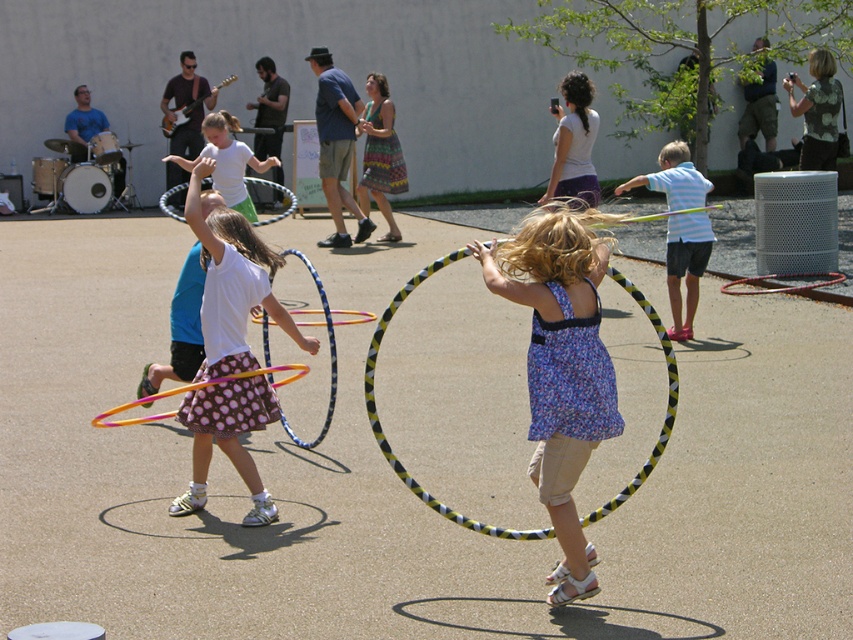
Question: From the image, what is the correct spatial relationship of floral fabric dress at center in relation to yellow and black striped hula hoop at center?

Choices:
 (A) above
 (B) below

Answer: (A)

Question: Which object is positioned closest to the white plastic hula hoop at center?

Choices:
 (A) white matte hula hoop at center
 (B) yellow and black striped hula hoop at center
 (C) white cotton shirt at center
 (D) floral fabric dress at center

Answer: (A)

Question: Is yellow and black striped hula hoop at center to the left of white matte hula hoop at center from the viewer's perspective?

Choices:
 (A) yes
 (B) no

Answer: (B)

Question: Which of these objects is positioned closest to the white matte hula hoop at center?

Choices:
 (A) white plastic hula hoop at center
 (B) floral fabric dress at center
 (C) white cotton shirt at center

Answer: (A)

Question: Does light blue striped shirt at right have a lesser width compared to white matte hula hoop at center?

Choices:
 (A) no
 (B) yes

Answer: (A)

Question: Which point is closer to the camera taking this photo?

Choices:
 (A) (566, 508)
 (B) (671, 157)

Answer: (A)